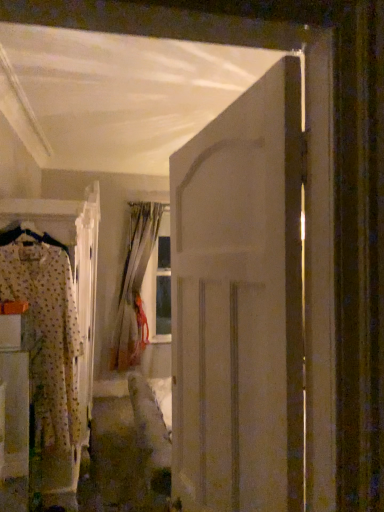
Question: Can you confirm if patterned fabric pajamas at left is smaller than white matte door at center?

Choices:
 (A) yes
 (B) no

Answer: (B)

Question: Is patterned fabric pajamas at left positioned with its back to white matte door at center?

Choices:
 (A) yes
 (B) no

Answer: (B)

Question: From a real-world perspective, is patterned fabric pajamas at left located higher than white matte door at center?

Choices:
 (A) no
 (B) yes

Answer: (A)

Question: Does patterned fabric pajamas at left have a larger size compared to white matte door at center?

Choices:
 (A) yes
 (B) no

Answer: (A)

Question: Is patterned fabric pajamas at left to the right of white matte door at center from the viewer's perspective?

Choices:
 (A) yes
 (B) no

Answer: (B)

Question: In terms of size, does fluffy fabric pajama set at left appear bigger or smaller than white matte door at center?

Choices:
 (A) big
 (B) small

Answer: (A)

Question: Is fluffy fabric pajama set at left inside the boundaries of white matte door at center, or outside?

Choices:
 (A) outside
 (B) inside

Answer: (A)

Question: From their relative heights in the image, would you say fluffy fabric pajama set at left is taller or shorter than white matte door at center?

Choices:
 (A) short
 (B) tall

Answer: (A)

Question: Considering the positions of point pos(4,343) and point pos(210,426), is point pos(4,343) closer or farther from the camera than point pos(210,426)?

Choices:
 (A) farther
 (B) closer

Answer: (A)

Question: In the image, is white matte door at center on the left side or the right side of fluffy fabric pajama set at left?

Choices:
 (A) right
 (B) left

Answer: (A)

Question: From the image's perspective, is white matte door at center located above or below fluffy fabric pajama set at left?

Choices:
 (A) below
 (B) above

Answer: (B)

Question: Considering the positions of point (185, 192) and point (4, 395), is point (185, 192) closer or farther from the camera than point (4, 395)?

Choices:
 (A) closer
 (B) farther

Answer: (A)

Question: In terms of size, does white matte door at center appear bigger or smaller than fluffy fabric pajama set at left?

Choices:
 (A) small
 (B) big

Answer: (A)

Question: Considering the positions of white matte door at center and patterned fabric pajamas at left in the image, is white matte door at center taller or shorter than patterned fabric pajamas at left?

Choices:
 (A) short
 (B) tall

Answer: (A)

Question: Which is correct: white matte door at center is inside patterned fabric pajamas at left, or outside of it?

Choices:
 (A) outside
 (B) inside

Answer: (A)